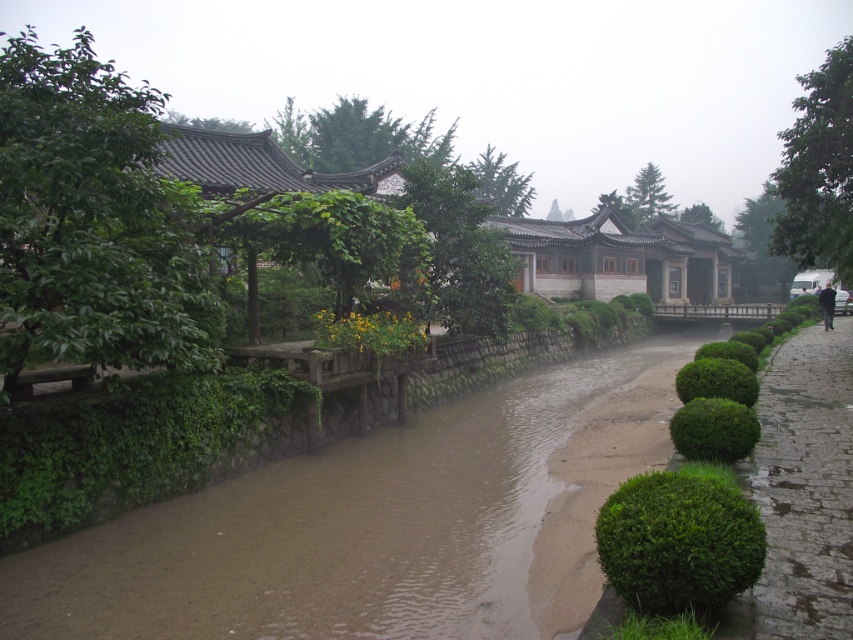
Question: Which of the following is the closest to the observer?

Choices:
 (A) paved stone path at right
 (B) brown muddy water at center

Answer: (A)

Question: Can you confirm if brown muddy water at center is thinner than paved stone path at right?

Choices:
 (A) no
 (B) yes

Answer: (A)

Question: Is brown muddy water at center smaller than paved stone path at right?

Choices:
 (A) no
 (B) yes

Answer: (B)

Question: Which point is farther to the camera?

Choices:
 (A) brown muddy water at center
 (B) paved stone path at right

Answer: (A)

Question: In this image, where is brown muddy water at center located relative to paved stone path at right?

Choices:
 (A) below
 (B) above

Answer: (A)